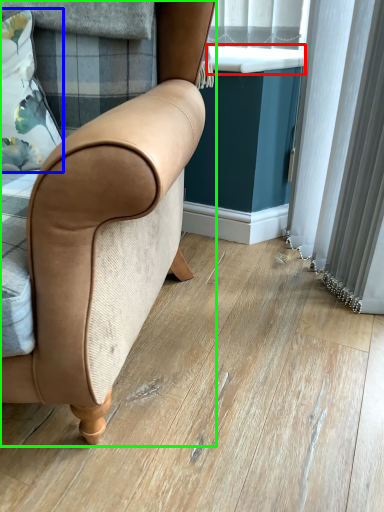
Question: Considering the real-world distances, which object is farthest from window sill (highlighted by a red box)? pillow (highlighted by a blue box) or chair (highlighted by a green box)?

Choices:
 (A) pillow
 (B) chair

Answer: (B)